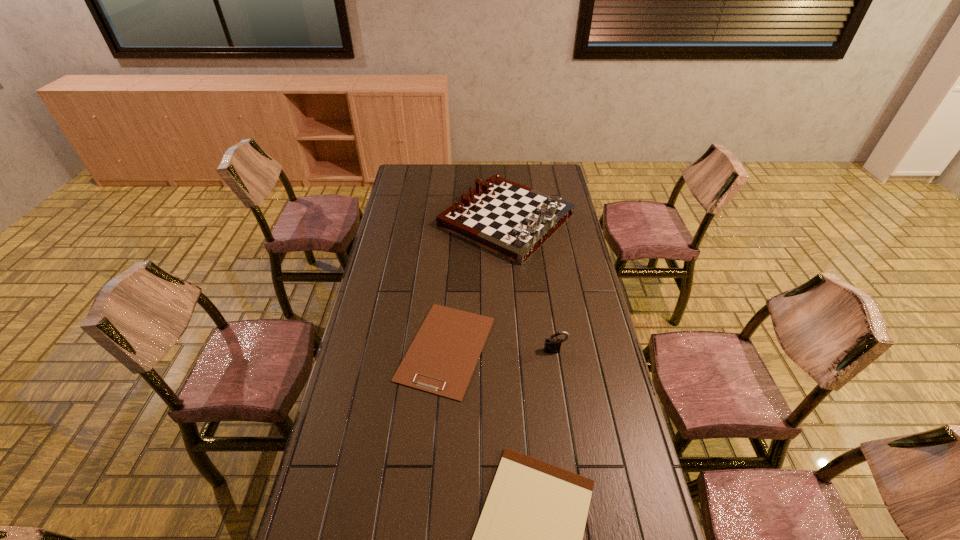
Identify which object is the second closest to the farthest object. Please provide its 2D coordinates. Your answer should be formatted as a tuple, i.e. [(x, y)], where the tuple contains the x and y coordinates of a point satisfying the conditions above.

[(552, 345)]

Identify which object is located as the nearest to the gameboard. Please provide its 2D coordinates. Your answer should be formatted as a tuple, i.e. [(x, y)], where the tuple contains the x and y coordinates of a point satisfying the conditions above.

[(441, 360)]